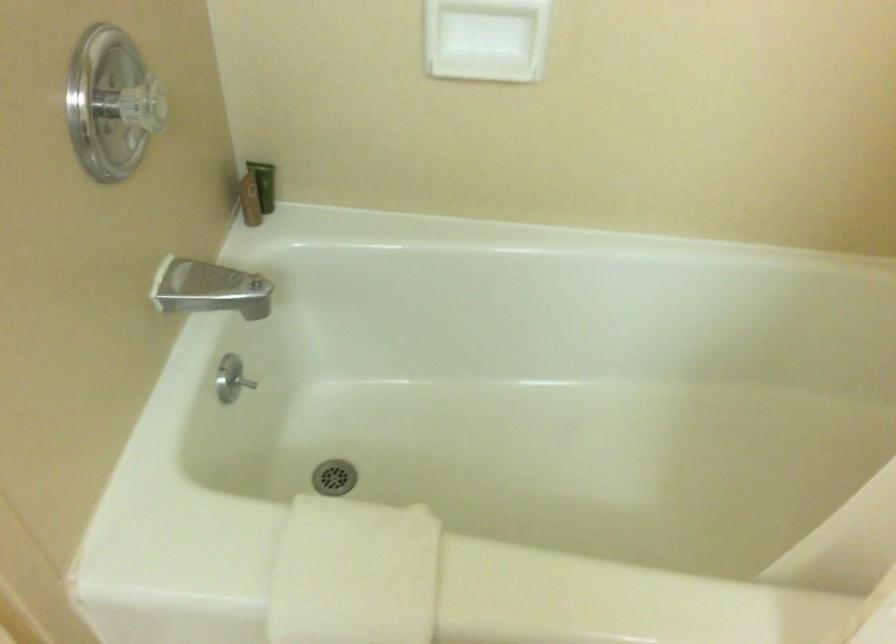
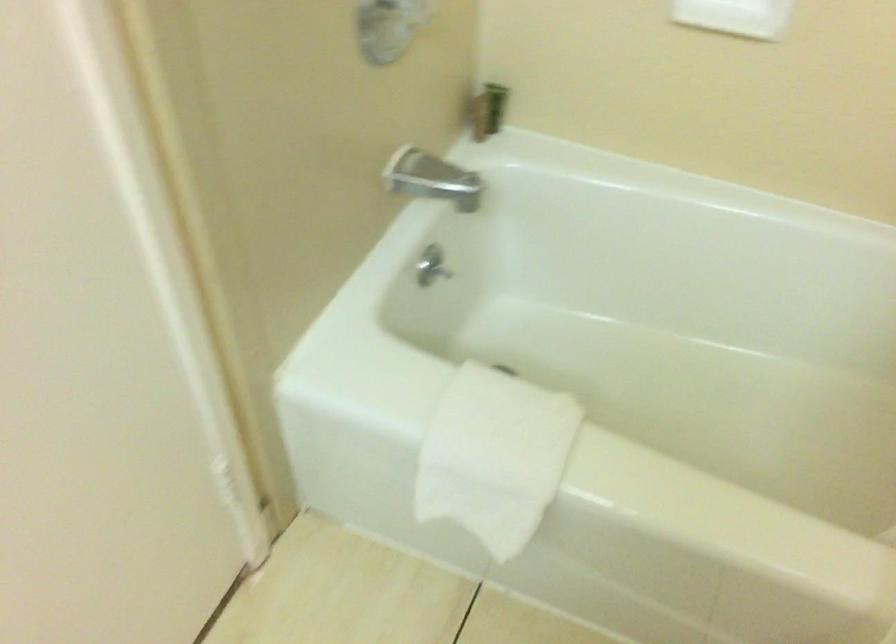
Locate, in the second image, the point that corresponds to (202,292) in the first image.

(424, 176)